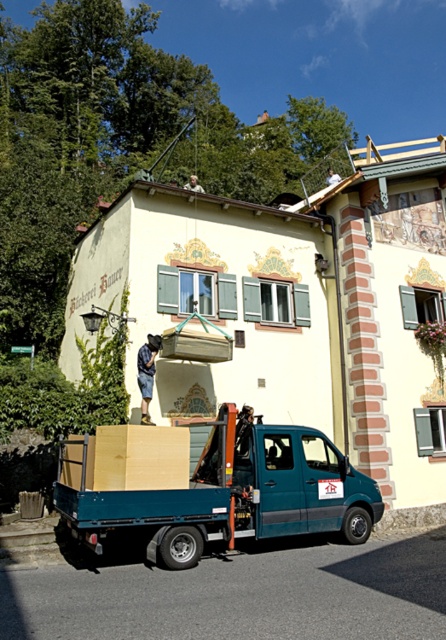
You are helping to load items onto the truck. You have a wooden crate at center and a light brown cardboard at center. Which item is taller?

The wooden crate at center is taller than the light brown cardboard at center.

You are helping move items from the roof to the truck. You have a wooden crate at center and a light brown cardboard at center. Which item should you move first to ensure the wider one fits through the truck door?

The wooden crate at center might be wider than light brown cardboard at center, so you should move the wooden crate at center first to ensure it fits through the truck door.

You are a delivery person who needs to place a wooden crate at center into the truck. The truck is at position point [217,490]. Where should you position the wooden crate at center relative to the truck?

The wooden crate at center should be positioned at point [217,490] to align with the truck.